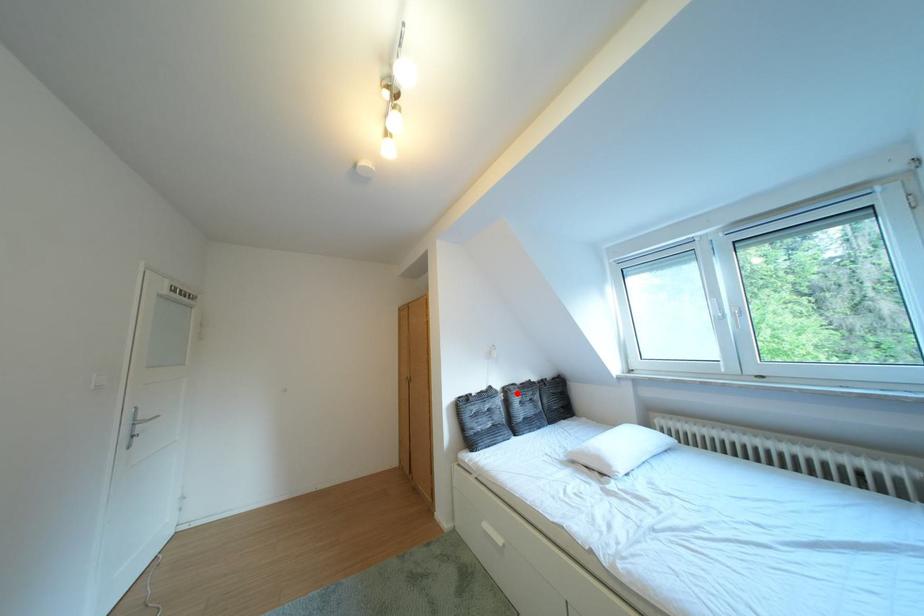
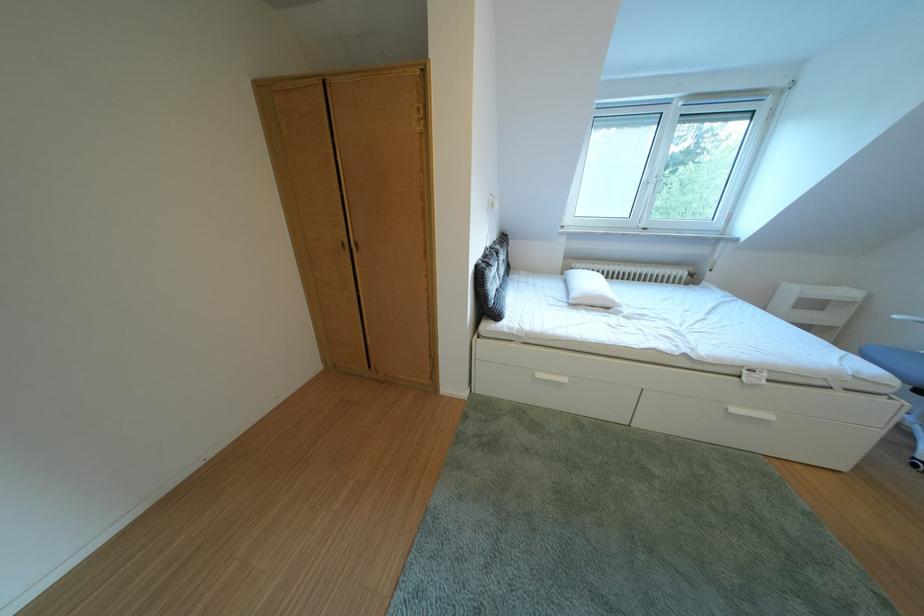
Where in the second image is the point corresponding to the highlighted location from the first image?

(505, 254)